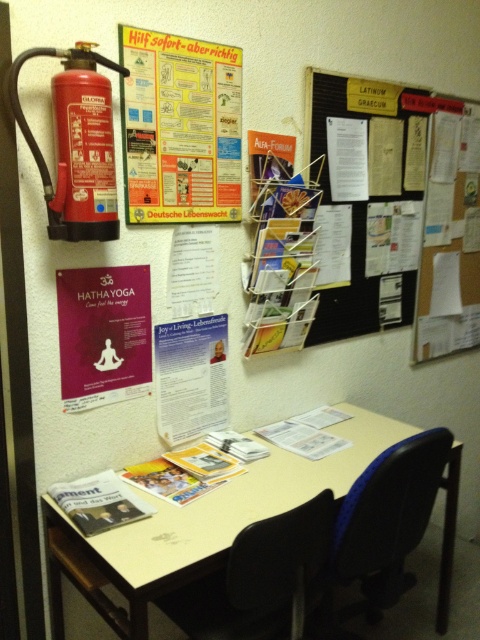
You are at the office and need to hang a new poster. You want to place it so it won not block the red matte fire extinguisher at upper left. Where should you place the new poster in relation to the purple glossy poster at lower left?

You should place the new poster behind the purple glossy poster at lower left because the red matte fire extinguisher at upper left is currently in front of the purple glossy poster at lower left, so placing the new poster behind the purple glossy poster at lower left would ensure it doesn not block the fire extinguisher.

Consider the image. You are a visitor at the office and need to sit down. You see the white plastic table at center and the black plastic swivel chair at lower center. Which object should you interact with to sit?

The black plastic swivel chair at lower center is the object you should interact with to sit, as chairs are designed for sitting while tables are for placing items.

You are standing at the origin point of the coordinate system in this office scene. You need to place a new poster exactly 0.5 meters to the right of the white plastic table at center. Where should you place the new poster in terms of coordinates?

The white plastic table at center is located at coordinates point [223,515]. To place the new poster 0.5 meters to the right, you would add 0.5 to the x coordinate, resulting in the new coordinates being [223,639].